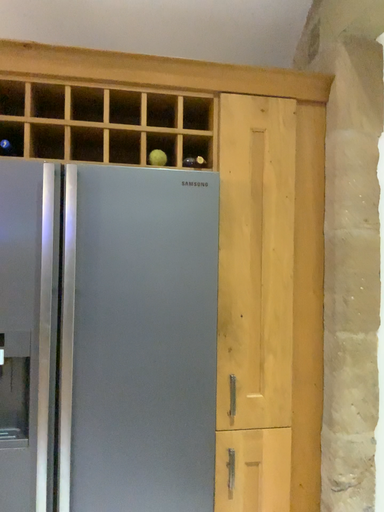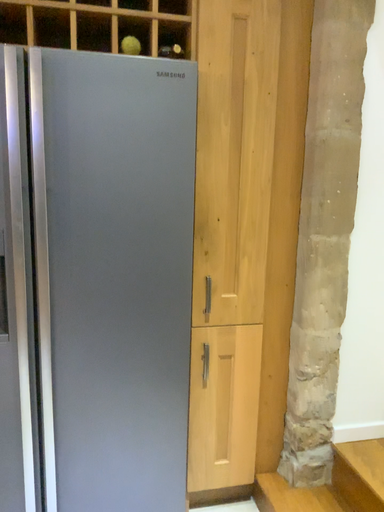
Question: Which way did the camera rotate in the video?

Choices:
 (A) rotated upward
 (B) rotated downward

Answer: (B)